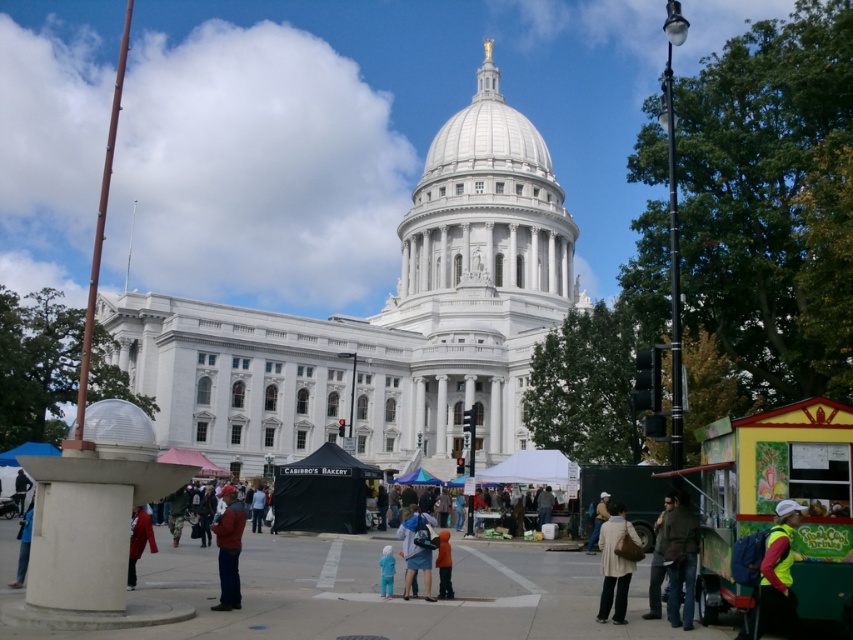
Who is positioned more to the left, multicolored fabric crowd at center or denim pants at lower left?

Positioned to the left is denim pants at lower left.

Between multicolored fabric crowd at center and denim pants at lower left, which one has more height?

denim pants at lower left is taller.

Is point (431, 497) positioned after point (20, 584)?

Yes.

Locate an element on the screen. multicolored fabric crowd at center is located at coordinates (431, 499).

Is point (782, 504) less distant than point (422, 520)?

Yes, point (782, 504) is in front of point (422, 520).

Is reflective yellow vest at lower right smaller than denim jacket at center?

Correct, reflective yellow vest at lower right occupies less space than denim jacket at center.

Is point (781, 540) closer to viewer compared to point (409, 538)?

That is True.

Find the location of `reflective yellow vest at lower right`. reflective yellow vest at lower right is located at coordinates (778, 572).

Who is more distant from viewer, (28, 524) or (258, 529)?

The point (258, 529) is more distant.

This screenshot has height=640, width=853. I want to click on denim pants at lower left, so [x=22, y=545].